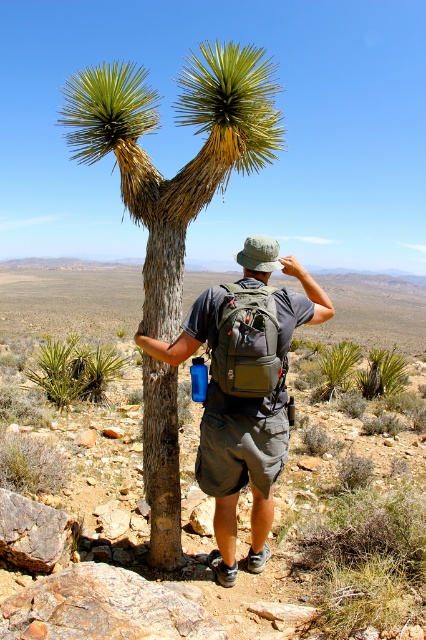
Question: Does green/yellow spiky plant at center have a smaller size compared to matte green backpack at center?

Choices:
 (A) no
 (B) yes

Answer: (A)

Question: Which of these objects is positioned closest to the matte green backpack at center?

Choices:
 (A) green/yellow spiky plant at center
 (B) green fabric backpack at back

Answer: (B)

Question: Can you confirm if green/yellow spiky plant at center is positioned to the left of green fabric backpack at back?

Choices:
 (A) yes
 (B) no

Answer: (A)

Question: Among these objects, which one is nearest to the camera?

Choices:
 (A) green/yellow spiky plant at center
 (B) green fabric backpack at back
 (C) matte green backpack at center

Answer: (B)

Question: Which point is farther from the camera taking this photo?

Choices:
 (A) (264, 97)
 (B) (262, 369)

Answer: (A)

Question: Is green/yellow spiky plant at center below matte green backpack at center?

Choices:
 (A) no
 (B) yes

Answer: (A)